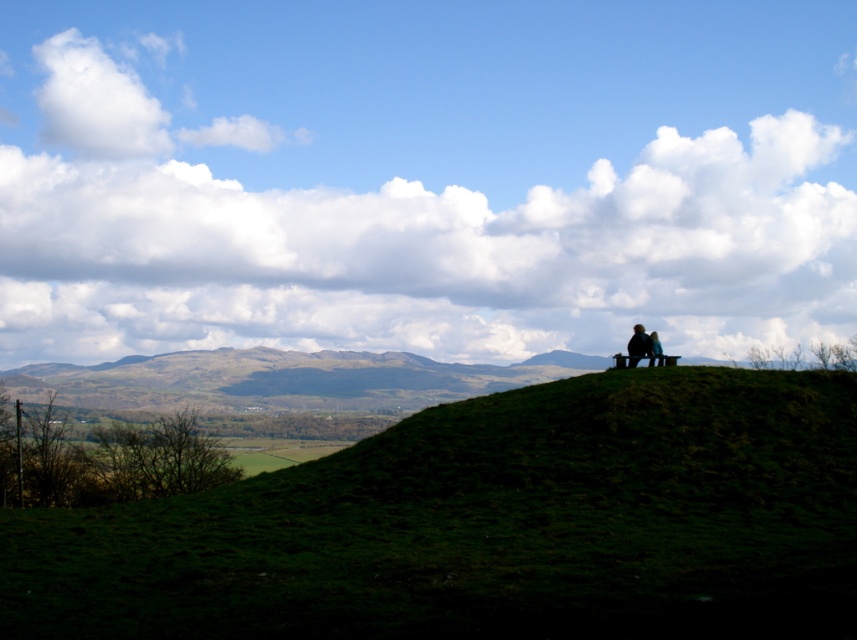
Question: Is green grassy hillside at upper center positioned behind silhouette wooden bench at upper right?

Choices:
 (A) yes
 (B) no

Answer: (B)

Question: Among these objects, which one is nearest to the camera?

Choices:
 (A) silhouette wooden bench at upper right
 (B) green grassy hillside at upper center

Answer: (B)

Question: Is green grassy hillside at upper center bigger than silhouette wooden bench at upper right?

Choices:
 (A) yes
 (B) no

Answer: (A)

Question: Which of the following is the closest to the observer?

Choices:
 (A) silhouette wooden bench at upper right
 (B) green grassy hillside at upper center

Answer: (B)

Question: Can you confirm if green grassy hillside at upper center is wider than silhouette wooden bench at upper right?

Choices:
 (A) yes
 (B) no

Answer: (A)